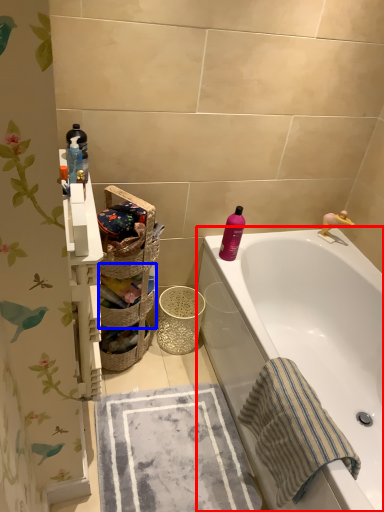
Question: Which of the following is the closest to the observer, bathtub (highlighted by a red box) or basket (highlighted by a blue box)?

Choices:
 (A) bathtub
 (B) basket

Answer: (A)